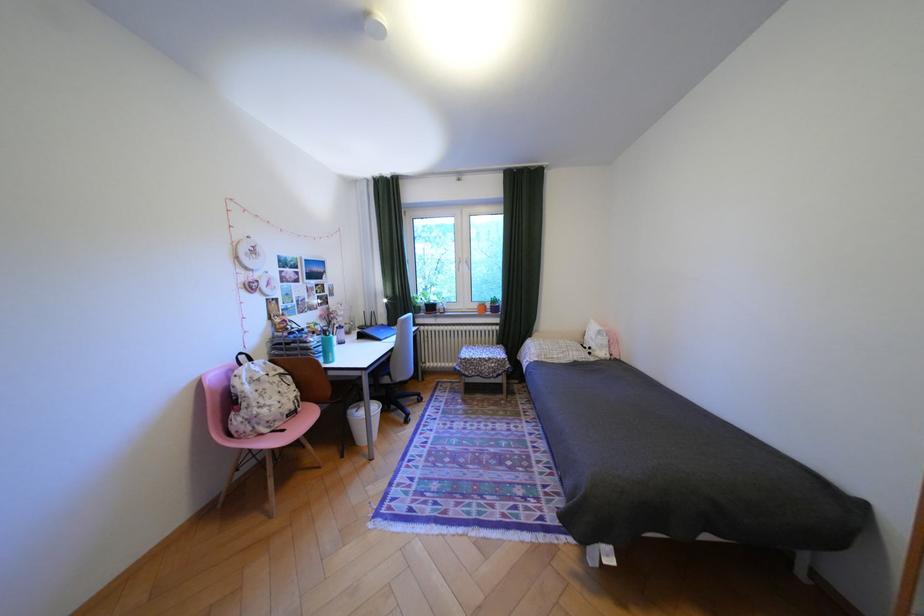
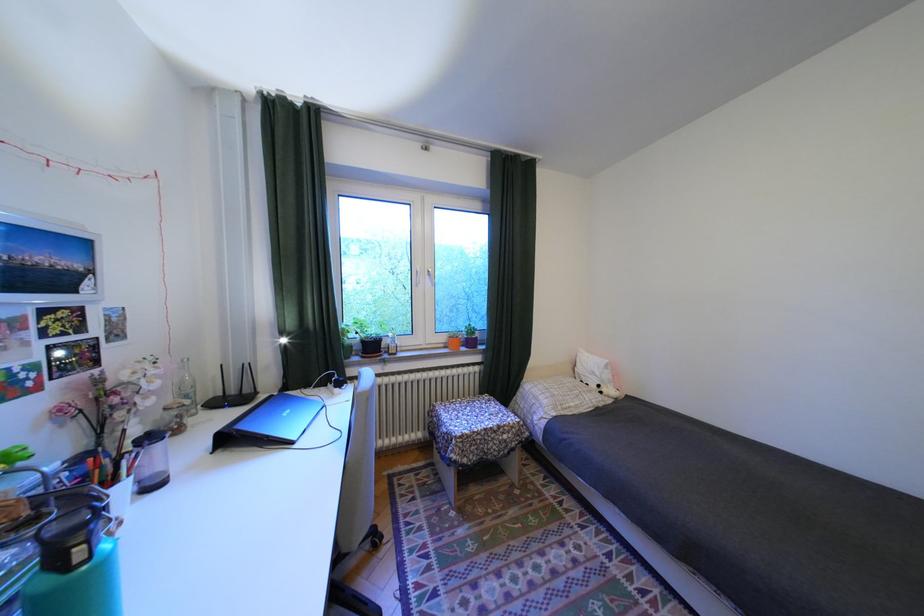
What movement of the cameraman would produce the second image?

The cameraman walked toward left, forward.